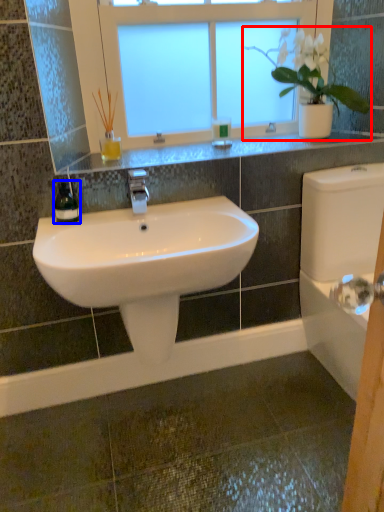
Question: Which of the following is the closest to the observer, houseplant (highlighted by a red box) or soap dispenser (highlighted by a blue box)?

Choices:
 (A) houseplant
 (B) soap dispenser

Answer: (B)